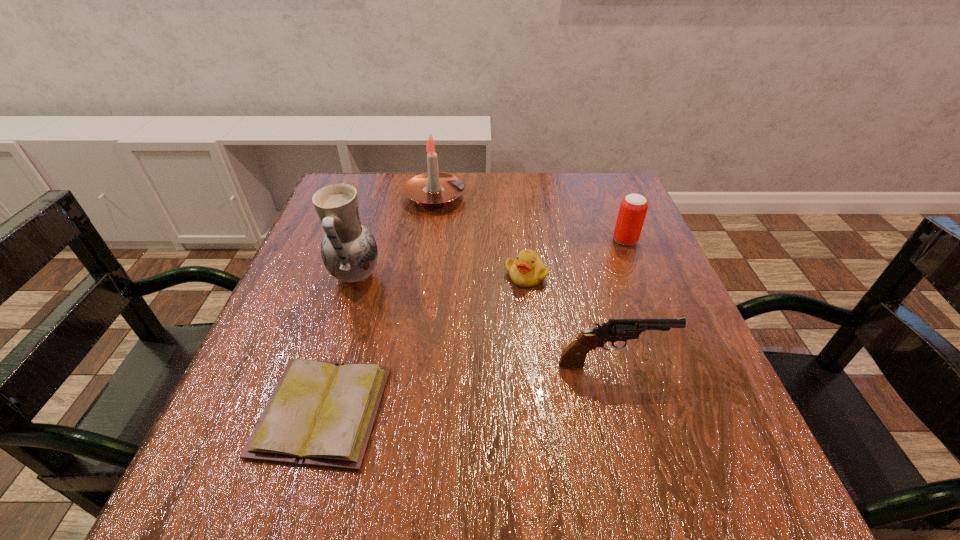
Identify the location of pottery. The width and height of the screenshot is (960, 540). (349, 252).

Where is `candle`? This screenshot has height=540, width=960. candle is located at coordinates (434, 189).

Image resolution: width=960 pixels, height=540 pixels. Find the location of `the fifth shortest object`. the fifth shortest object is located at coordinates (434, 189).

The height and width of the screenshot is (540, 960). In order to click on gun in this screenshot , I will do `click(573, 356)`.

Locate an element on the screen. The image size is (960, 540). the fifth nearest object is located at coordinates (633, 208).

I want to click on the second shortest object, so click(528, 270).

Image resolution: width=960 pixels, height=540 pixels. I want to click on diary, so click(x=321, y=413).

Locate an element on the screen. free spot located 0.310m on either side of the pottery is located at coordinates (529, 276).

Where is `vacant space located on the right of the farthest object`? This screenshot has width=960, height=540. vacant space located on the right of the farthest object is located at coordinates (572, 197).

Find the location of a particular element. The height and width of the screenshot is (540, 960). free region located 0.050m along the barrel of the gun is located at coordinates (696, 364).